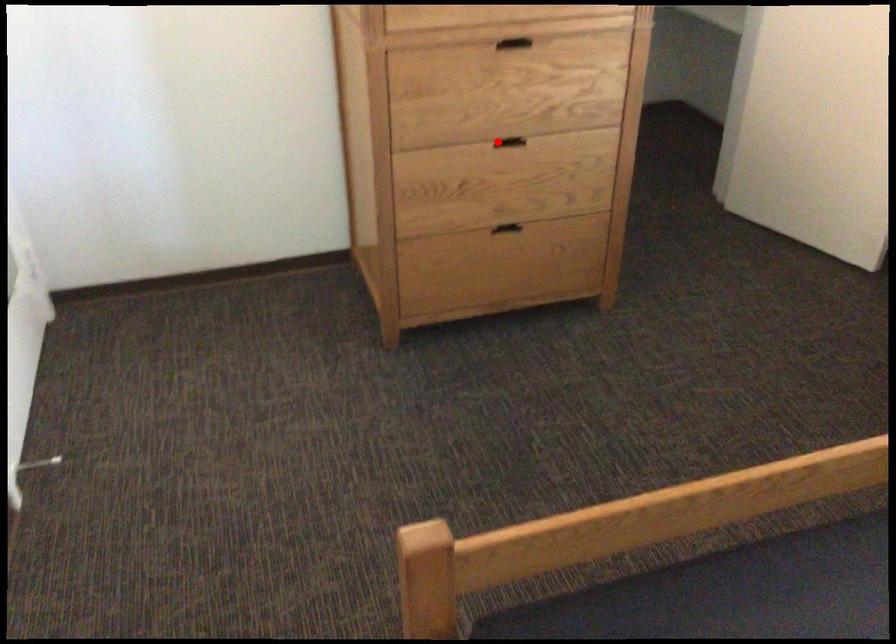
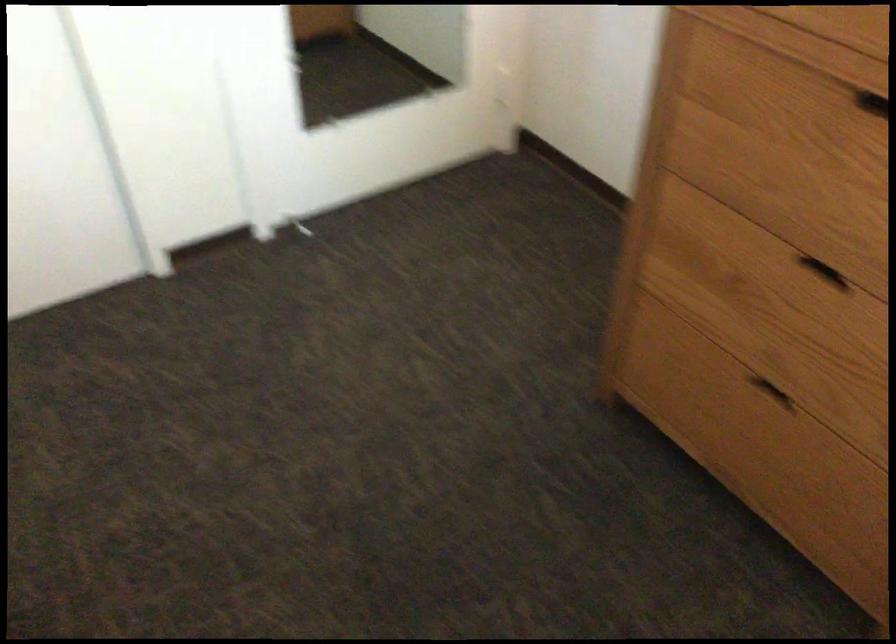
Question: I am providing you with two images of the same scene from different viewpoints. Image1 has a red point marked. In image2, the corresponding 3D location appears at what relative position? Reply with the corresponding letter.

Choices:
 (A) Closer
 (B) Farther

Answer: (A)